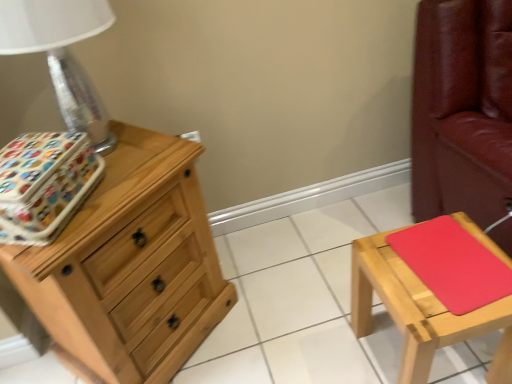
Question: Is matte wood stool at right oriented towards red matte pad at right?

Choices:
 (A) no
 (B) yes

Answer: (A)

Question: Is red matte pad at right located within matte wood stool at right?

Choices:
 (A) no
 (B) yes

Answer: (B)

Question: Can you confirm if matte wood stool at right is thinner than red matte pad at right?

Choices:
 (A) yes
 (B) no

Answer: (B)

Question: Is matte wood stool at right positioned beyond the bounds of red matte pad at right?

Choices:
 (A) yes
 (B) no

Answer: (A)

Question: Are matte wood stool at right and red matte pad at right making contact?

Choices:
 (A) yes
 (B) no

Answer: (A)

Question: From a real-world perspective, is matte wood stool at right located higher than red matte pad at right?

Choices:
 (A) no
 (B) yes

Answer: (A)

Question: Is red matte pad at right shorter than natural wood chest of drawers at left?

Choices:
 (A) no
 (B) yes

Answer: (B)

Question: Is red matte pad at right looking in the opposite direction of natural wood chest of drawers at left?

Choices:
 (A) yes
 (B) no

Answer: (B)

Question: Is red matte pad at right not near natural wood chest of drawers at left?

Choices:
 (A) yes
 (B) no

Answer: (B)

Question: From a real-world perspective, does red matte pad at right sit lower than natural wood chest of drawers at left?

Choices:
 (A) yes
 (B) no

Answer: (B)

Question: Is red matte pad at right outside of natural wood chest of drawers at left?

Choices:
 (A) no
 (B) yes

Answer: (B)

Question: Does red matte pad at right lie behind natural wood chest of drawers at left?

Choices:
 (A) yes
 (B) no

Answer: (A)

Question: From a real-world perspective, is natural wood chest of drawers at left on metallic silver table lamp at left?

Choices:
 (A) no
 (B) yes

Answer: (A)